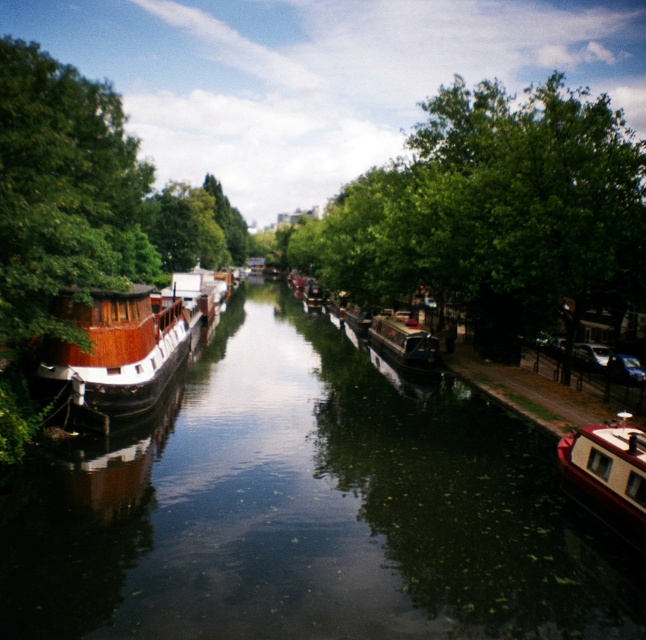
In the scene shown: Who is more distant from viewer, (276, 506) or (99, 372)?

The point (99, 372) is more distant.

From the picture: Is wooden canal boat at left in front of wooden cabin cruiser at left?

Yes.

Is point (149, 468) positioned after point (147, 340)?

No, it is in front of (147, 340).

You are a GUI agent. You are given a task and a screenshot of the screen. Output one action in this format:
    pyautogui.click(x=<x>, y=<y>)
    Task: Click on the wooden canal boat at left
    
    Given the screenshot: What is the action you would take?
    pyautogui.click(x=307, y=508)

Between shiny red boat at lower right and wooden polished boat at center, which one is positioned lower?

Positioned lower is shiny red boat at lower right.

Find the location of a particular element. The image size is (646, 640). shiny red boat at lower right is located at coordinates (607, 474).

Who is lower down, green leafy tree at center or wooden polished boat at center?

Positioned lower is wooden polished boat at center.

Which is in front, point (472, 189) or point (388, 348)?

Point (472, 189) is more forward.

Does point (589, 291) come behind point (410, 352)?

That is False.

At what (x,y) coordinates should I click in order to perform the action: click on green leafy tree at center. Please return your answer as a coordinate pair (x, y). The height and width of the screenshot is (640, 646). Looking at the image, I should click on (495, 214).